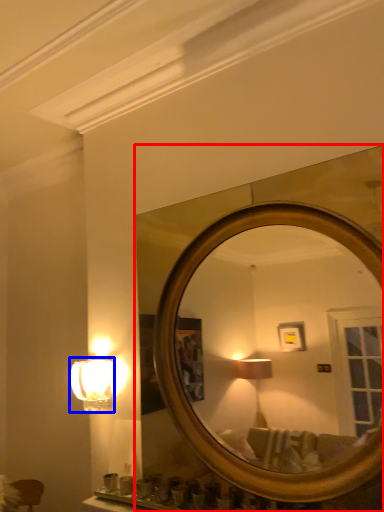
Question: Which of the following is the farthest to the observer, mirror (highlighted by a red box) or lamp (highlighted by a blue box)?

Choices:
 (A) mirror
 (B) lamp

Answer: (B)